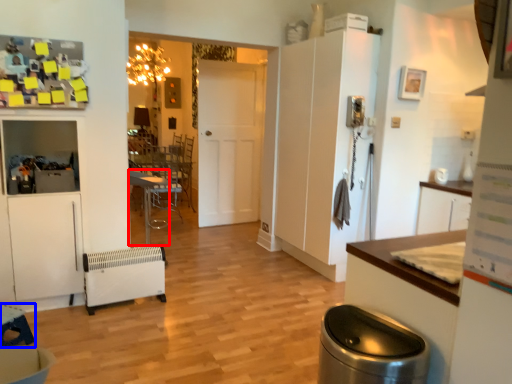
Question: Which of the following is the closest to the observer, table (highlighted by a red box) or table (highlighted by a blue box)?

Choices:
 (A) table
 (B) table

Answer: (B)